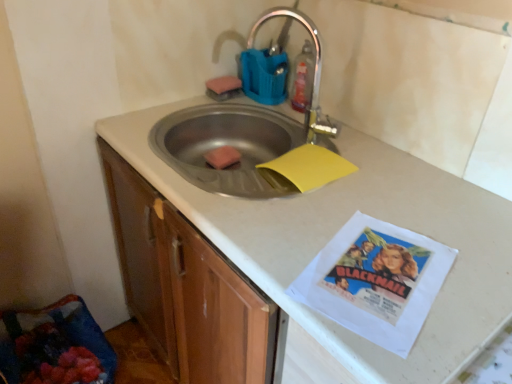
Where is `free point above yellow matte paper at sink (from a real-world perspective)`? free point above yellow matte paper at sink (from a real-world perspective) is located at coordinates (314, 160).